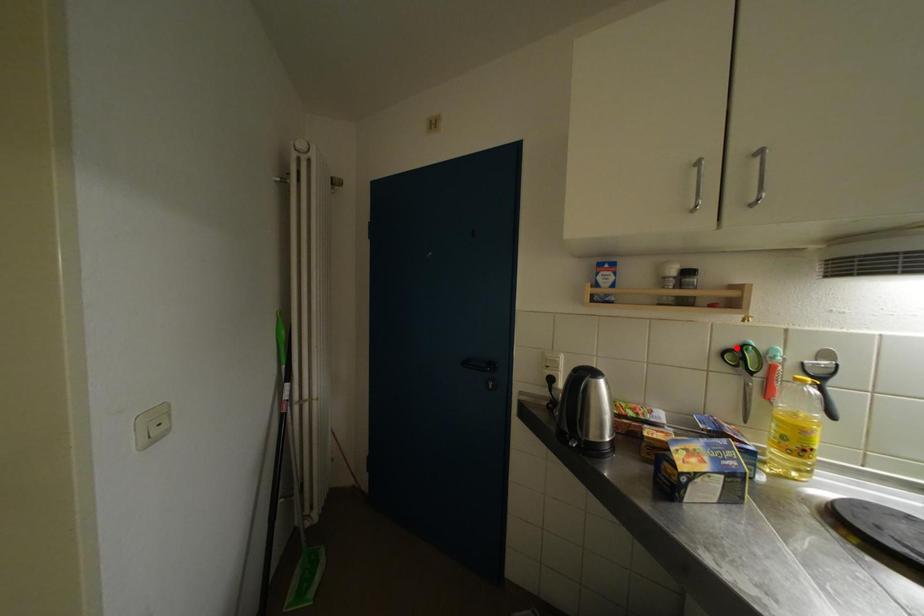
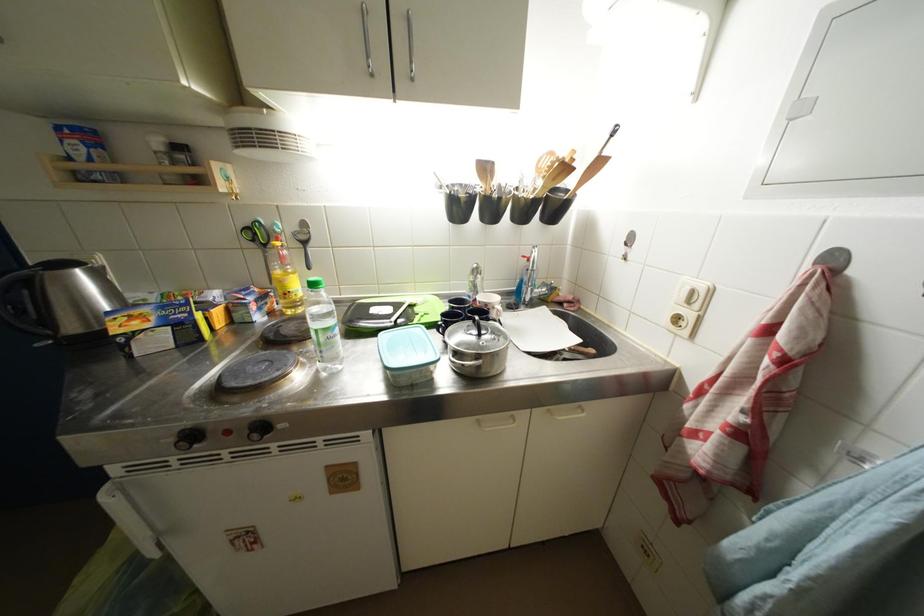
Locate, in the second image, the point that corresponds to the highlighted location in the first image.

(253, 227)